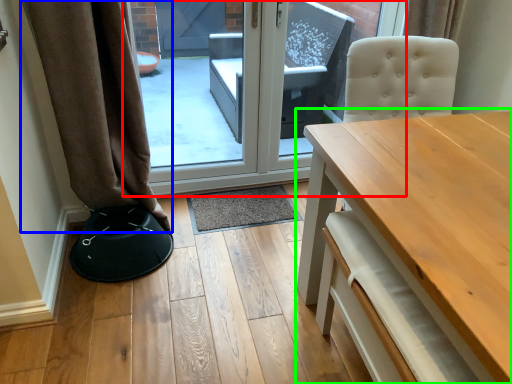
Question: Estimate the real-world distances between objects in this image. Which object is farther from door (highlighted by a red box), curtain (highlighted by a blue box) or table (highlighted by a green box)?

Choices:
 (A) curtain
 (B) table

Answer: (B)